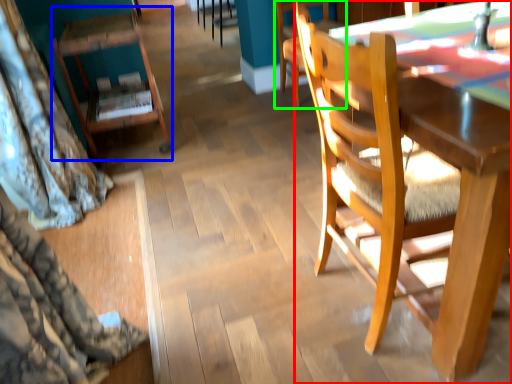
Question: Which object is positioned farthest from chair (highlighted by a red box)? Select from chair (highlighted by a blue box) and chair (highlighted by a green box).

Choices:
 (A) chair
 (B) chair

Answer: (B)